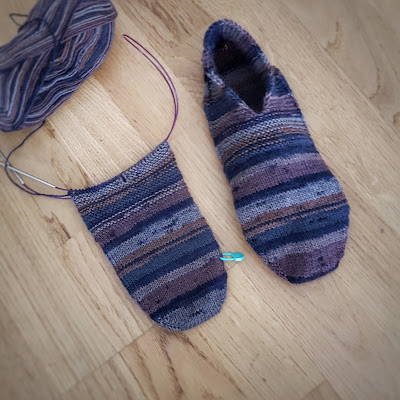
Locate an element on the screen. blond wood in upper (my) right corner is located at coordinates (352, 42).